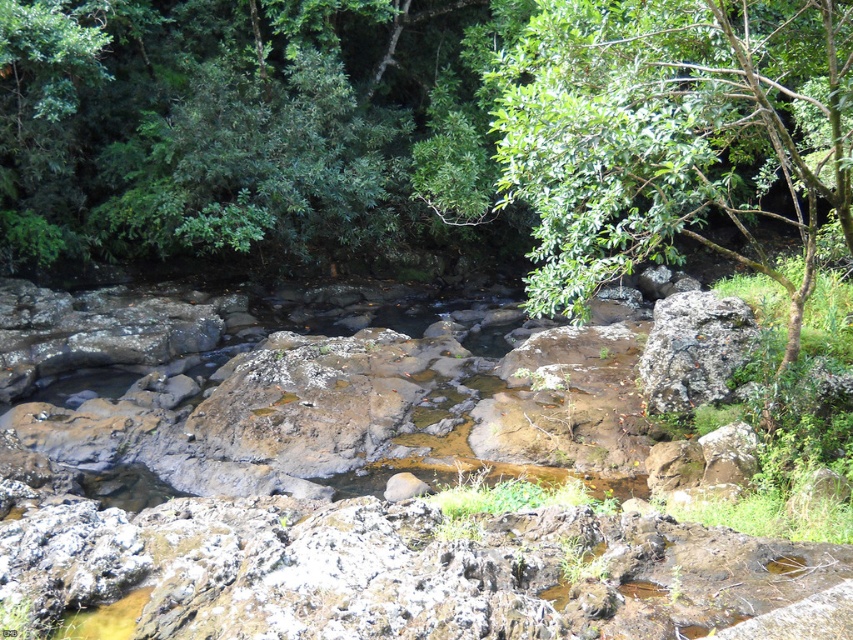
How much distance is there between green leafy tree at upper right and rusty metallic boulder at right?

green leafy tree at upper right is 9.65 feet from rusty metallic boulder at right.

Does green leafy tree at upper right appear on the right side of rusty metallic boulder at right?

Correct, you'll find green leafy tree at upper right to the right of rusty metallic boulder at right.

Image resolution: width=853 pixels, height=640 pixels. What do you see at coordinates (674, 132) in the screenshot?
I see `green leafy tree at upper right` at bounding box center [674, 132].

This screenshot has width=853, height=640. I want to click on green leafy tree at upper right, so click(x=674, y=132).